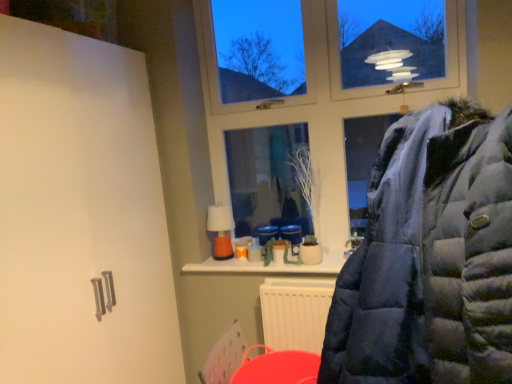
You are a GUI agent. You are given a task and a screenshot of the screen. Output one action in this format:
    pyautogui.click(x=<x>, y=<y>)
    Task: Click on the transparent glass window at upper center
    The height and width of the screenshot is (384, 512).
    Given the screenshot: What is the action you would take?
    pyautogui.click(x=316, y=116)

Where is `dark blue puffer jacket at center`? This screenshot has width=512, height=384. dark blue puffer jacket at center is located at coordinates (430, 258).

Identify the location of transparent glass window at upper center. pyautogui.click(x=316, y=116).

Is transparent glass window at upper center positioned far away from dark blue puffer jacket at center?

Indeed, transparent glass window at upper center is not near dark blue puffer jacket at center.

Is transparent glass window at upper center closer to the viewer compared to dark blue puffer jacket at center?

No, transparent glass window at upper center is behind dark blue puffer jacket at center.

Between point (464, 86) and point (350, 287), which one is positioned in front?

The point (350, 287) is in front.

This screenshot has height=384, width=512. Find the location of `window lying on the left of dark blue puffer jacket at center`. window lying on the left of dark blue puffer jacket at center is located at coordinates [x=316, y=116].

Considering the relative positions of dark blue puffer jacket at center and transparent glass window at upper center in the image provided, is dark blue puffer jacket at center behind transparent glass window at upper center?

No.

Is point (425, 316) closer or farther from the camera than point (322, 110)?

Clearly, point (425, 316) is closer to the camera than point (322, 110).

Considering the sizes of objects dark blue puffer jacket at center and transparent glass window at upper center in the image provided, who is taller, dark blue puffer jacket at center or transparent glass window at upper center?

transparent glass window at upper center is taller.

The image size is (512, 384). Find the location of `window behind the rubberized plastic bucket at lower center`. window behind the rubberized plastic bucket at lower center is located at coordinates (316, 116).

From the image's perspective, is rubberized plastic bucket at lower center below transparent glass window at upper center?

Correct, rubberized plastic bucket at lower center appears lower than transparent glass window at upper center in the image.

Based on the photo, is rubberized plastic bucket at lower center looking in the opposite direction of transparent glass window at upper center?

No, rubberized plastic bucket at lower center is not facing away from transparent glass window at upper center.

Which is closer to the camera, (285, 364) or (317, 115)?

Point (285, 364) is positioned closer to the camera compared to point (317, 115).

Considering the sizes of objects dark blue puffer jacket at center and rubberized plastic bucket at lower center in the image provided, who is wider, dark blue puffer jacket at center or rubberized plastic bucket at lower center?

dark blue puffer jacket at center is wider.

Is dark blue puffer jacket at center behind rubberized plastic bucket at lower center?

That is False.

Which is in front, point (397, 274) or point (287, 383)?

Positioned in front is point (397, 274).

Who is taller, transparent glass window at upper center or rubberized plastic bucket at lower center?

transparent glass window at upper center.

Are transparent glass window at upper center and rubberized plastic bucket at lower center making contact?

No.

Who is more distant, transparent glass window at upper center or rubberized plastic bucket at lower center?

Positioned behind is transparent glass window at upper center.

This screenshot has height=384, width=512. I want to click on table in front of the transparent glass window at upper center, so click(277, 367).

In the image, there is a rubberized plastic bucket at lower center. Where is `jacket above it (from the image's perspective)`? Image resolution: width=512 pixels, height=384 pixels. jacket above it (from the image's perspective) is located at coordinates (430, 258).

Which is in front, point (274, 381) or point (490, 186)?

The point (490, 186) is closer.

Looking at their sizes, would you say rubberized plastic bucket at lower center is wider or thinner than dark blue puffer jacket at center?

In the image, rubberized plastic bucket at lower center appears to be more narrow than dark blue puffer jacket at center.

Looking at this image, in terms of size, does rubberized plastic bucket at lower center appear bigger or smaller than dark blue puffer jacket at center?

In the image, rubberized plastic bucket at lower center appears to be smaller than dark blue puffer jacket at center.

Locate an element on the screen. This screenshot has height=384, width=512. window to the left of dark blue puffer jacket at center is located at coordinates (316, 116).

Where is `window that is behind the dark blue puffer jacket at center`? The image size is (512, 384). window that is behind the dark blue puffer jacket at center is located at coordinates (316, 116).

Estimate the real-world distances between objects in this image. Which object is closer to transparent glass window at upper center, dark blue puffer jacket at center or rubberized plastic bucket at lower center?

The object closer to transparent glass window at upper center is rubberized plastic bucket at lower center.

Considering their positions, is rubberized plastic bucket at lower center positioned further to dark blue puffer jacket at center than transparent glass window at upper center?

transparent glass window at upper center is positioned further to the anchor dark blue puffer jacket at center.

Looking at the image, which one is located further to dark blue puffer jacket at center, transparent glass window at upper center or rubberized plastic bucket at lower center?

Based on the image, transparent glass window at upper center appears to be further to dark blue puffer jacket at center.

When comparing their distances from rubberized plastic bucket at lower center, does dark blue puffer jacket at center or transparent glass window at upper center seem closer?

transparent glass window at upper center is positioned closer to the anchor rubberized plastic bucket at lower center.

From the picture: When comparing their distances from rubberized plastic bucket at lower center, does transparent glass window at upper center or dark blue puffer jacket at center seem further?

dark blue puffer jacket at center.

Estimate the real-world distances between objects in this image. Which object is further from transparent glass window at upper center, rubberized plastic bucket at lower center or dark blue puffer jacket at center?

dark blue puffer jacket at center is positioned further to the anchor transparent glass window at upper center.

Identify the location of table positioned between dark blue puffer jacket at center and transparent glass window at upper center from near to far. The height and width of the screenshot is (384, 512). (277, 367).